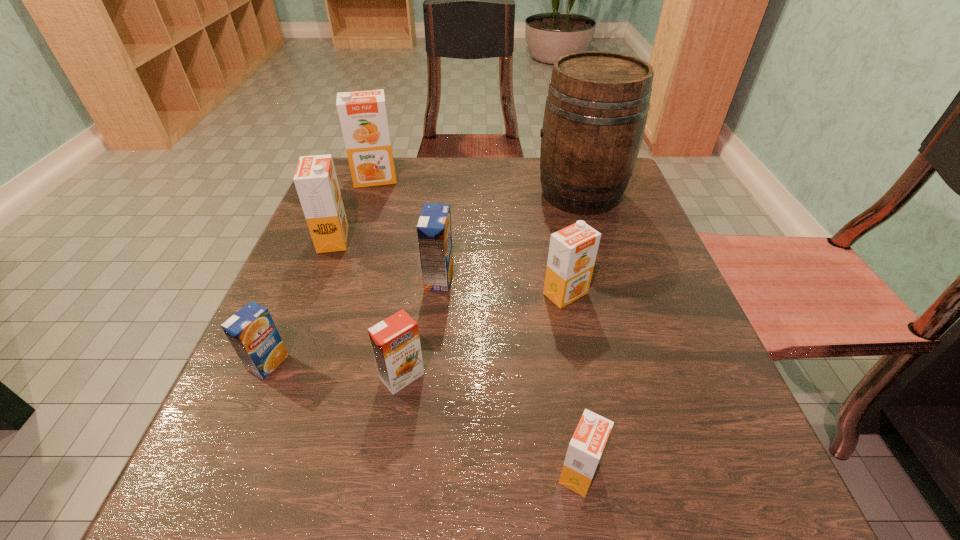
Point out which orange orange juice is positioned as the third nearest to the third orange orange juice from left to right. Please provide its 2D coordinates. Your answer should be formatted as a tuple, i.e. [(x, y)], where the tuple contains the x and y coordinates of a point satisfying the conditions above.

[(315, 179)]

Image resolution: width=960 pixels, height=540 pixels. I want to click on vacant space that satisfies the following two spatial constraints: 1. on the front side of the smaller blue orange_juice; 2. on the left side of the nearest orange juice, so click(x=223, y=472).

You are a GUI agent. You are given a task and a screenshot of the screen. Output one action in this format:
    pyautogui.click(x=<x>, y=<y>)
    Task: Click on the vacant position in the image that satisfies the following two spatial constraints: 1. on the side of the cider near the bung hole; 2. on the front side of the third biggest orange orange juice
    
    Given the screenshot: What is the action you would take?
    pyautogui.click(x=611, y=293)

Find the location of a particular element. free spot that satisfies the following two spatial constraints: 1. on the back side of the third orange orange juice from right to left; 2. on the left side of the third smallest orange orange juice is located at coordinates (415, 293).